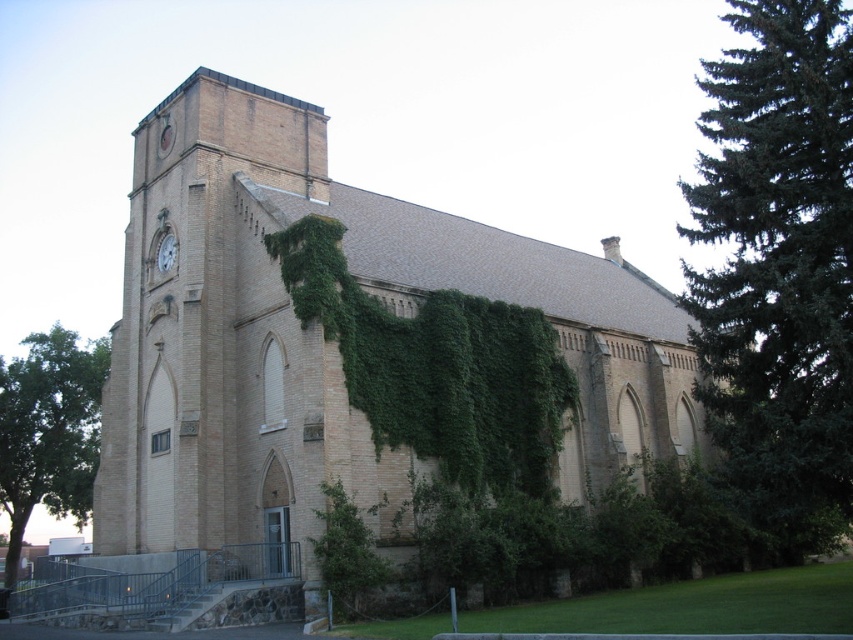
Question: Is brown brick church at center bigger than green leafy tree at lower left?

Choices:
 (A) yes
 (B) no

Answer: (B)

Question: Considering the real-world distances, which object is closest to the green leafy tree at lower left?

Choices:
 (A) brown brick church at center
 (B) green needle-like at right

Answer: (A)

Question: Can you confirm if green needle-like at right is positioned below green leafy tree at lower left?

Choices:
 (A) yes
 (B) no

Answer: (B)

Question: Which of the following is the farthest from the observer?

Choices:
 (A) (83, 461)
 (B) (781, 381)

Answer: (A)

Question: Is green needle-like at right below green leafy tree at lower left?

Choices:
 (A) no
 (B) yes

Answer: (A)

Question: Which of the following is the farthest from the observer?

Choices:
 (A) brown brick church at center
 (B) green leafy tree at lower left

Answer: (B)